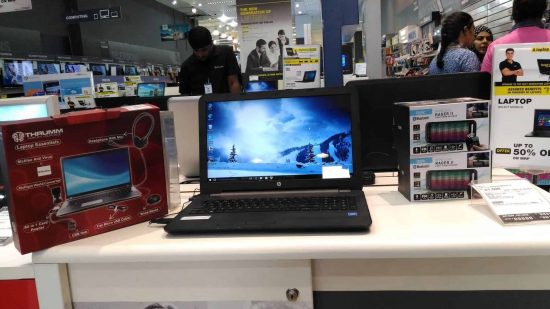
Where is `white desk`? This screenshot has height=309, width=550. white desk is located at coordinates (442, 231).